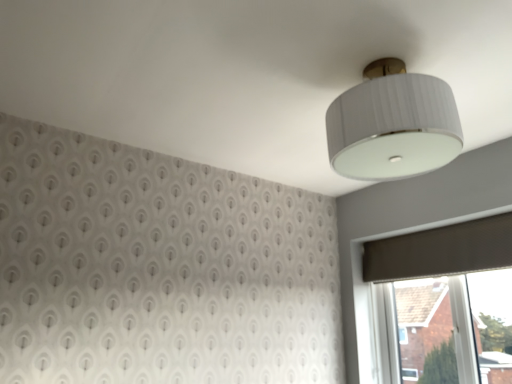
Where is `white fabric lampshade at upper center`? Image resolution: width=512 pixels, height=384 pixels. white fabric lampshade at upper center is located at coordinates (393, 124).

Describe the element at coordinates (393, 124) in the screenshot. I see `white fabric lampshade at upper center` at that location.

What is the approximate height of white fabric lampshade at upper center?

white fabric lampshade at upper center is 37.91 centimeters tall.

Where is `white fabric lampshade at upper center`? This screenshot has width=512, height=384. white fabric lampshade at upper center is located at coordinates (393, 124).